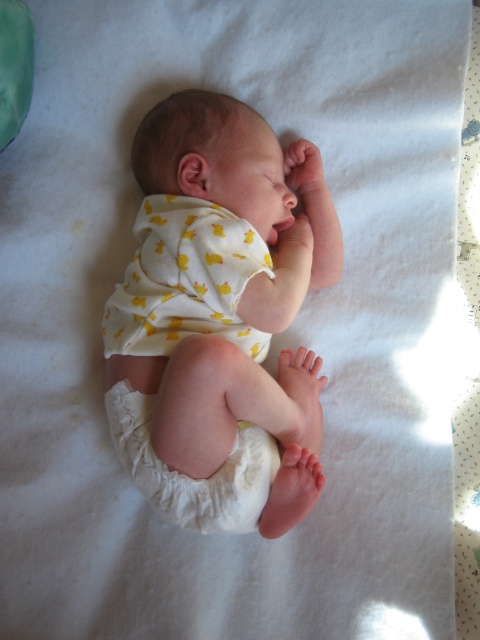
Which is behind, point (257, 115) or point (253, 522)?

The point (257, 115) is more distant.

Between point (181, 202) and point (243, 433), which one is positioned in front?

Point (243, 433) is more forward.

At what (x,y) coordinates should I click in order to perform the action: click on white cotton newborn at center. Please return your answer as a coordinate pair (x, y). Image resolution: width=480 pixels, height=640 pixels. Looking at the image, I should click on (219, 317).

In order to click on white cotton newborn at center in this screenshot , I will do `click(219, 317)`.